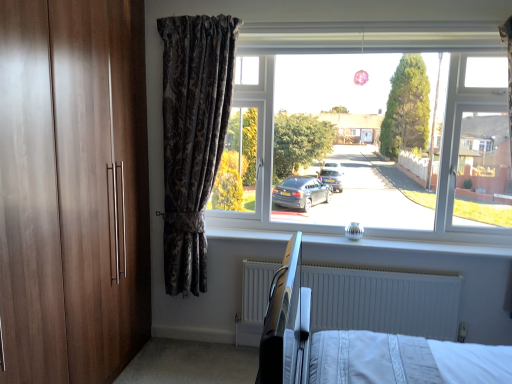
You are a GUI agent. You are given a task and a screenshot of the screen. Output one action in this format:
    pyautogui.click(x=<x>, y=<y>)
    Task: Click on the transparent glass window at center
    Image resolution: width=512 pixels, height=384 pixels.
    Given the screenshot: What is the action you would take?
    pyautogui.click(x=379, y=147)

The height and width of the screenshot is (384, 512). What do you see at coordinates (379, 147) in the screenshot?
I see `transparent glass window at center` at bounding box center [379, 147].

I want to click on dark floral fabric curtain at center, so (x=193, y=136).

Is metallic hospital bed at center turned away from dark floral fabric curtain at center?

No, metallic hospital bed at center's orientation is not away from dark floral fabric curtain at center.

Which of these two, metallic hospital bed at center or dark floral fabric curtain at center, is thinner?

Thinner between the two is dark floral fabric curtain at center.

Locate an element on the screen. The height and width of the screenshot is (384, 512). hospital bed on the right side of dark floral fabric curtain at center is located at coordinates (321, 317).

Is silver metallic knob at center oriented towards metallic hospital bed at center?

Yes, silver metallic knob at center is facing metallic hospital bed at center.

From the image's perspective, is silver metallic knob at center on metallic hospital bed at center?

Yes, from the image's perspective, silver metallic knob at center is over metallic hospital bed at center.

How different are the orientations of silver metallic knob at center and metallic hospital bed at center in degrees?

90 degrees.

Does point (401, 244) appear closer or farther from the camera than point (283, 259)?

Point (401, 244) is farther from the camera than point (283, 259).

From the image's perspective, is dark floral fabric curtain at center above or below white textured radiator at lower center?

dark floral fabric curtain at center is above white textured radiator at lower center.

Identify the location of radiator below the dark floral fabric curtain at center (from the image's perspective). pos(383,301).

From a real-world perspective, who is located higher, dark floral fabric curtain at center or white textured radiator at lower center?

From a 3D spatial view, dark floral fabric curtain at center is above.

Considering the relative positions of transparent glass window at center and silver metallic knob at center in the image provided, is transparent glass window at center behind silver metallic knob at center?

No, transparent glass window at center is closer to the viewer.

Can you tell me how much transparent glass window at center and silver metallic knob at center differ in facing direction?

transparent glass window at center and silver metallic knob at center are facing 0.394 degrees away from each other.

From the picture: Between transparent glass window at center and silver metallic knob at center, which one has smaller size?

With smaller size is silver metallic knob at center.

Could you tell me if transparent glass window at center is turned towards silver metallic knob at center?

No, transparent glass window at center does not turn towards silver metallic knob at center.

In the image, is metallic hospital bed at center positioned in front of or behind transparent glass window at center?

Clearly, metallic hospital bed at center is in front of transparent glass window at center.

Is metallic hospital bed at center to the right of transparent glass window at center from the viewer's perspective?

No.

Consider the image. Is metallic hospital bed at center not near transparent glass window at center?

Actually, metallic hospital bed at center and transparent glass window at center are a little close together.

Considering the relative sizes of metallic hospital bed at center and transparent glass window at center in the image provided, is metallic hospital bed at center shorter than transparent glass window at center?

Correct, metallic hospital bed at center is not as tall as transparent glass window at center.

Between white textured radiator at lower center and transparent glass window at center, which one has smaller size?

white textured radiator at lower center.

Do you think white textured radiator at lower center is within transparent glass window at center, or outside of it?

white textured radiator at lower center is spatially situated outside transparent glass window at center.

From the picture: Could you tell me if white textured radiator at lower center is turned towards transparent glass window at center?

No.

Does silver metallic knob at center turn towards white textured radiator at lower center?

No, silver metallic knob at center is not facing towards white textured radiator at lower center.

Is point (376, 239) positioned after point (384, 327)?

That is True.

Considering the positions of objects silver metallic knob at center and white textured radiator at lower center in the image provided, who is more to the left, silver metallic knob at center or white textured radiator at lower center?

Positioned to the left is white textured radiator at lower center.

From a real-world perspective, is silver metallic knob at center physically located above or below white textured radiator at lower center?

silver metallic knob at center is above white textured radiator at lower center.

Where is `hospital bed below the dark floral fabric curtain at center (from a real-world perspective)`? hospital bed below the dark floral fabric curtain at center (from a real-world perspective) is located at coordinates pos(321,317).

The image size is (512, 384). Identify the location of window sill located above the metallic hospital bed at center (from the image's perspective). (412, 245).

Based on their spatial positions, is metallic hospital bed at center or transparent glass window at center closer to white textured radiator at lower center?

metallic hospital bed at center is positioned closer to the anchor white textured radiator at lower center.

Considering their positions, is metallic hospital bed at center positioned closer to transparent glass window at center than dark floral fabric curtain at center?

Among the two, metallic hospital bed at center is located nearer to transparent glass window at center.

Which object lies further to the anchor point white textured radiator at lower center, metallic hospital bed at center or dark floral fabric curtain at center?

dark floral fabric curtain at center is positioned further to the anchor white textured radiator at lower center.

When comparing their distances from silver metallic knob at center, does white textured radiator at lower center or transparent glass window at center seem closer?

white textured radiator at lower center is positioned closer to the anchor silver metallic knob at center.

When comparing their distances from white textured radiator at lower center, does silver metallic knob at center or dark floral fabric curtain at center seem closer?

silver metallic knob at center is positioned closer to the anchor white textured radiator at lower center.

Estimate the real-world distances between objects in this image. Which object is closer to white textured radiator at lower center, silver metallic knob at center or metallic hospital bed at center?

Based on the image, metallic hospital bed at center appears to be nearer to white textured radiator at lower center.

Based on their spatial positions, is dark floral fabric curtain at center or silver metallic knob at center further from transparent glass window at center?

Among the two, dark floral fabric curtain at center is located further to transparent glass window at center.

Which object lies nearer to the anchor point transparent glass window at center, white textured radiator at lower center or silver metallic knob at center?

Based on the image, silver metallic knob at center appears to be nearer to transparent glass window at center.

Identify the location of curtain between metallic hospital bed at center and silver metallic knob at center along the z-axis. This screenshot has height=384, width=512. (193, 136).

Locate an element on the screen. This screenshot has height=384, width=512. window located between metallic hospital bed at center and white textured radiator at lower center in the depth direction is located at coordinates (379, 147).

The height and width of the screenshot is (384, 512). What are the coordinates of `curtain between transparent glass window at center and white textured radiator at lower center from top to bottom` in the screenshot? It's located at (193, 136).

Where is `curtain positioned between metallic hospital bed at center and transparent glass window at center from near to far`? The width and height of the screenshot is (512, 384). curtain positioned between metallic hospital bed at center and transparent glass window at center from near to far is located at coordinates (193, 136).